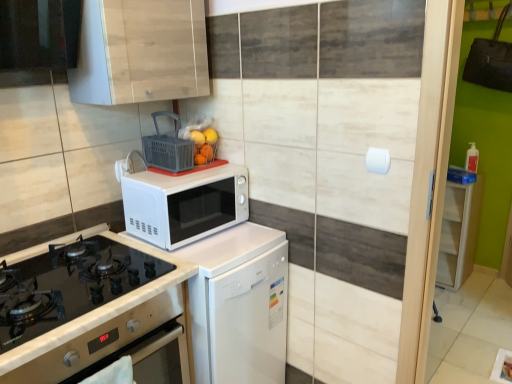
Question: Is plastic basket at upper center a part of white wood cabinet at right, which is counted as the 2th cabinetry, starting from the front?

Choices:
 (A) yes
 (B) no

Answer: (B)

Question: Is white wood cabinet at right, the 2th cabinetry positioned from the left, facing towards plastic basket at upper center?

Choices:
 (A) yes
 (B) no

Answer: (B)

Question: Is white wood cabinet at right, arranged as the 1th cabinetry when ordered from the bottom, facing away from plastic basket at upper center?

Choices:
 (A) no
 (B) yes

Answer: (A)

Question: From the image's perspective, does white wood cabinet at right, which ranks as the first cabinetry in right-to-left order, appear higher than plastic basket at upper center?

Choices:
 (A) yes
 (B) no

Answer: (B)

Question: Is white wood cabinet at right, acting as the 1th cabinetry starting from the back, smaller than plastic basket at upper center?

Choices:
 (A) no
 (B) yes

Answer: (A)

Question: Considering their positions, is white matte microwave at center located in front of or behind white glossy dishwasher at center?

Choices:
 (A) behind
 (B) front

Answer: (A)

Question: Considering the positions of white matte microwave at center and white glossy dishwasher at center in the image, is white matte microwave at center wider or thinner than white glossy dishwasher at center?

Choices:
 (A) thin
 (B) wide

Answer: (A)

Question: Is white matte microwave at center inside or outside of white glossy dishwasher at center?

Choices:
 (A) inside
 (B) outside

Answer: (B)

Question: From the image's perspective, is white matte microwave at center located above or below white glossy dishwasher at center?

Choices:
 (A) above
 (B) below

Answer: (A)

Question: Does point (15, 74) appear closer or farther from the camera than point (5, 324)?

Choices:
 (A) closer
 (B) farther

Answer: (B)

Question: Is black glass exhaust hood at upper left inside or outside of black glass gas stove at lower left?

Choices:
 (A) outside
 (B) inside

Answer: (A)

Question: Considering their positions, is black glass exhaust hood at upper left located in front of or behind black glass gas stove at lower left?

Choices:
 (A) front
 (B) behind

Answer: (B)

Question: From their relative heights in the image, would you say black glass exhaust hood at upper left is taller or shorter than black glass gas stove at lower left?

Choices:
 (A) short
 (B) tall

Answer: (B)

Question: Looking at their shapes, would you say white wood cabinet at right, acting as the 1th cabinetry starting from the back, is wider or thinner than white glossy dishwasher at center?

Choices:
 (A) wide
 (B) thin

Answer: (B)

Question: From a real-world perspective, relative to white glossy dishwasher at center, is white wood cabinet at right, the 2th cabinetry positioned from the left, vertically above or below?

Choices:
 (A) below
 (B) above

Answer: (A)